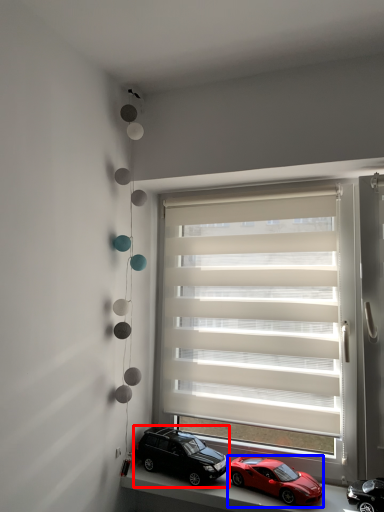
Question: Which of the following is the closest to the observer, car (highlighted by a red box) or car (highlighted by a blue box)?

Choices:
 (A) car
 (B) car

Answer: (B)